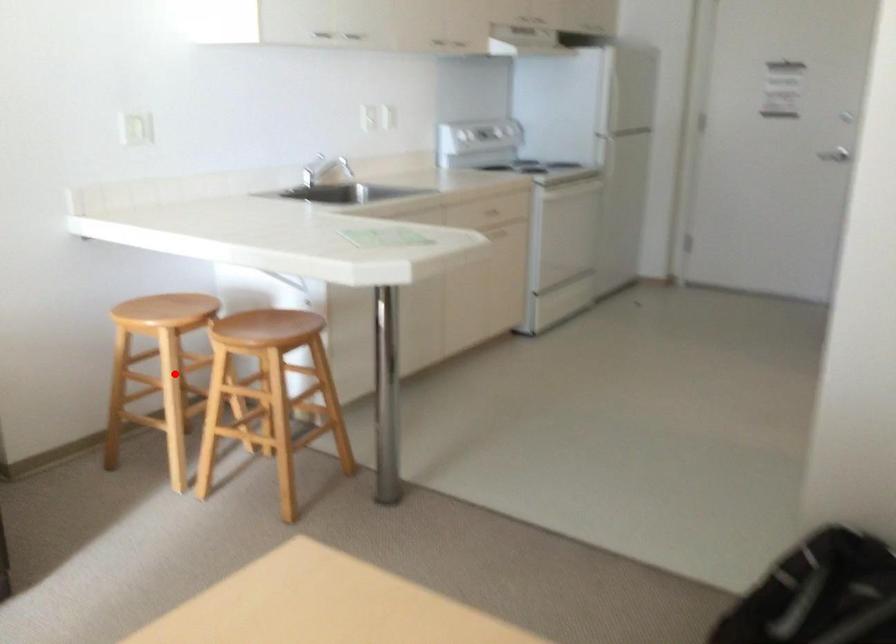
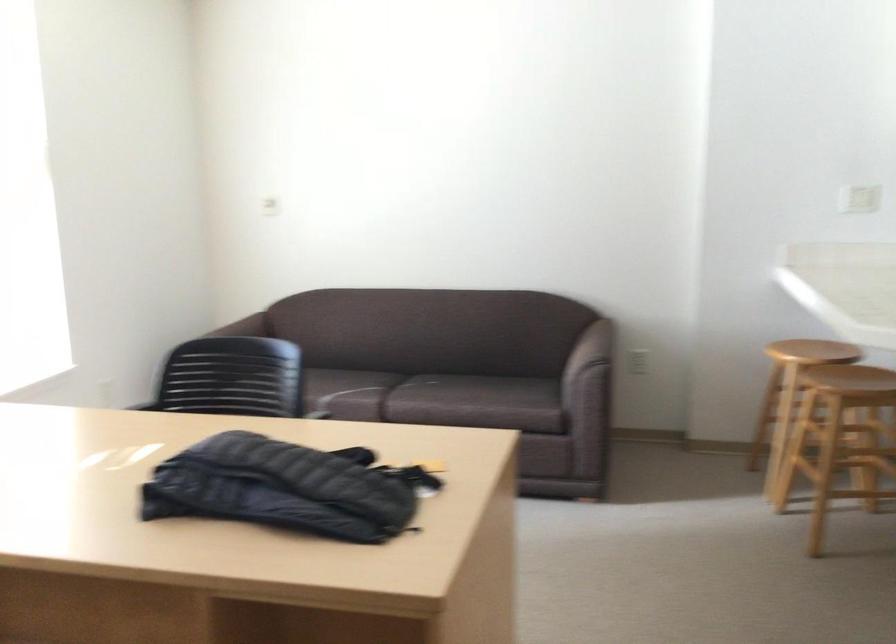
Question: I am providing you with two images of the same scene from different viewpoints. Given a red point in image1, look at the same physical point in image2. Is it:

Choices:
 (A) Closer to the viewpoint
 (B) Farther from the viewpoint

Answer: (B)